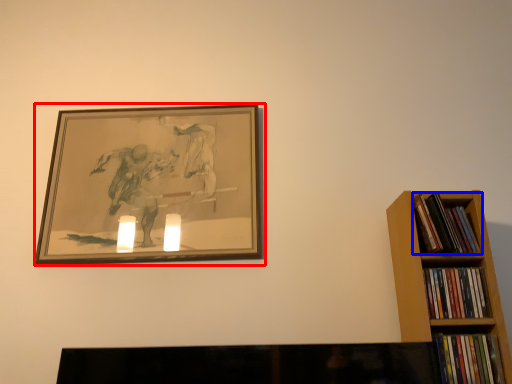
Question: Which object appears farthest to the camera in this image, picture frame (highlighted by a red box) or book (highlighted by a blue box)?

Choices:
 (A) picture frame
 (B) book

Answer: (A)